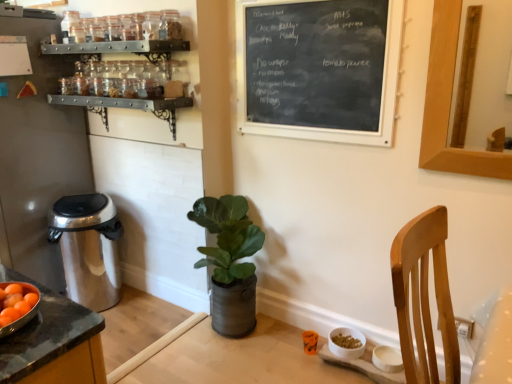
Question: Should I look upward or downward to see black chalkboard at upper center?

Choices:
 (A) up
 (B) down

Answer: (A)

Question: From a real-world perspective, is brushed metal trash can at left below satin silver trash can at left?

Choices:
 (A) yes
 (B) no

Answer: (B)

Question: Considering the relative sizes of brushed metal trash can at left and satin silver trash can at left in the image provided, is brushed metal trash can at left taller than satin silver trash can at left?

Choices:
 (A) yes
 (B) no

Answer: (A)

Question: Would you say brushed metal trash can at left is a long distance from satin silver trash can at left?

Choices:
 (A) no
 (B) yes

Answer: (A)

Question: Can you confirm if brushed metal trash can at left is thinner than satin silver trash can at left?

Choices:
 (A) no
 (B) yes

Answer: (A)

Question: Considering the relative sizes of brushed metal trash can at left and satin silver trash can at left in the image provided, is brushed metal trash can at left bigger than satin silver trash can at left?

Choices:
 (A) no
 (B) yes

Answer: (B)

Question: Is brushed metal trash can at left facing towards satin silver trash can at left?

Choices:
 (A) no
 (B) yes

Answer: (A)

Question: Is black chalkboard at upper center not within brushed metal trash can at left?

Choices:
 (A) no
 (B) yes

Answer: (B)

Question: Is black chalkboard at upper center bigger than brushed metal trash can at left?

Choices:
 (A) yes
 (B) no

Answer: (B)

Question: Is black chalkboard at upper center in contact with brushed metal trash can at left?

Choices:
 (A) no
 (B) yes

Answer: (A)

Question: From the image's perspective, does black chalkboard at upper center appear higher than brushed metal trash can at left?

Choices:
 (A) yes
 (B) no

Answer: (A)

Question: Is black chalkboard at upper center shorter than brushed metal trash can at left?

Choices:
 (A) yes
 (B) no

Answer: (A)

Question: Is black chalkboard at upper center at the left side of brushed metal trash can at left?

Choices:
 (A) yes
 (B) no

Answer: (B)

Question: From the image's perspective, is metallic spice rack at upper left, placed as the 2th shelf when sorted from bottom to top, located above green leafy plant in metallic pot at center?

Choices:
 (A) no
 (B) yes

Answer: (B)